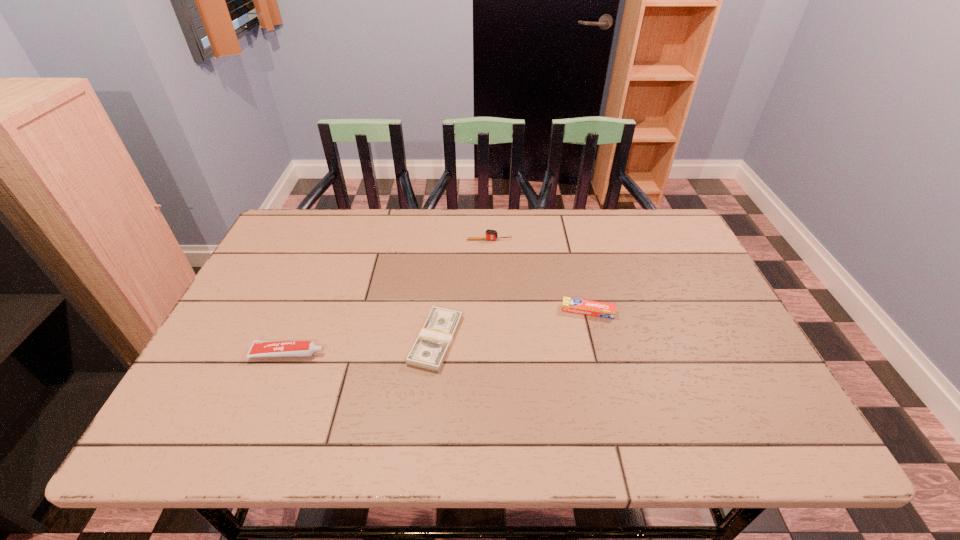
The height and width of the screenshot is (540, 960). I want to click on free space that satisfies the following two spatial constraints: 1. on the back side of the farther toothpaste; 2. on the right side of the shortest object, so click(439, 311).

This screenshot has height=540, width=960. In order to click on free space that satisfies the following two spatial constraints: 1. on the front side of the rightmost object; 2. at the nozzle of the taller toothpaste in this screenshot , I will do `click(598, 354)`.

Where is `vacant position in the image that satisfies the following two spatial constraints: 1. on the back side of the farthest object; 2. on the right side of the third object from right to left`? vacant position in the image that satisfies the following two spatial constraints: 1. on the back side of the farthest object; 2. on the right side of the third object from right to left is located at coordinates (445, 240).